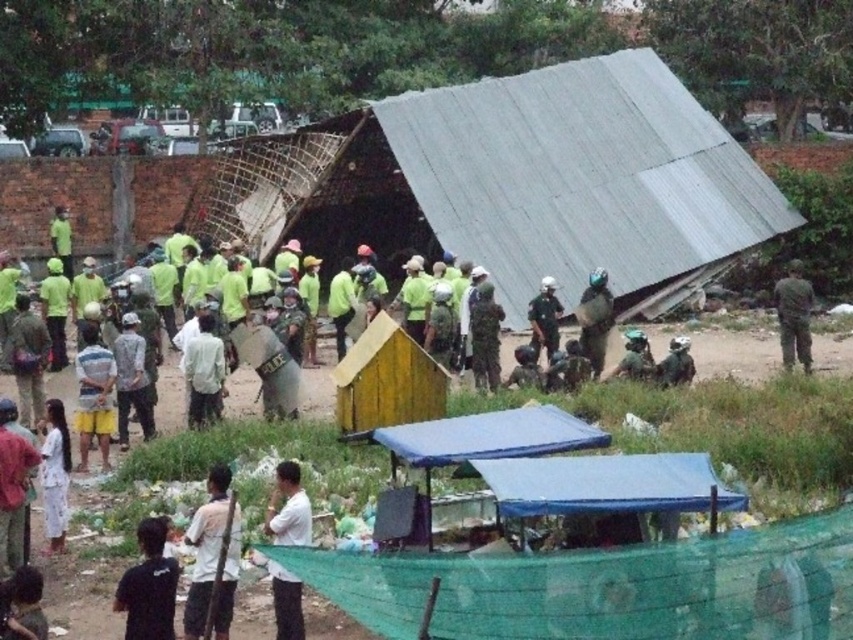
Is point (216, 529) positioned in front of point (281, 472)?

Yes, it is in front of point (281, 472).

Which is behind, point (236, 536) or point (306, 506)?

Positioned behind is point (236, 536).

Where is `white matte shirt at lower center`? white matte shirt at lower center is located at coordinates (206, 548).

Where is `white matte shirt at lower center`? This screenshot has height=640, width=853. white matte shirt at lower center is located at coordinates (206, 548).

Who is positioned more to the left, white matte shirt at lower center or black matte shirt at lower left?

black matte shirt at lower left

Who is more distant from viewer, [207,476] or [163,524]?

The point [207,476] is behind.

The image size is (853, 640). Identify the location of white matte shirt at lower center. 206,548.

Which is in front, point (219, 620) or point (53, 419)?

Point (219, 620) is in front.

Image resolution: width=853 pixels, height=640 pixels. Describe the element at coordinates (206, 548) in the screenshot. I see `white matte shirt at lower center` at that location.

Who is more distant from viewer, (202, 630) or (48, 502)?

The point (48, 502) is behind.

You are a GUI agent. You are given a task and a screenshot of the screen. Output one action in this format:
    pyautogui.click(x=<x>, y=<y>)
    Task: Click on the white matte shirt at lower center
    This screenshot has height=640, width=853.
    Given the screenshot: What is the action you would take?
    pyautogui.click(x=206, y=548)